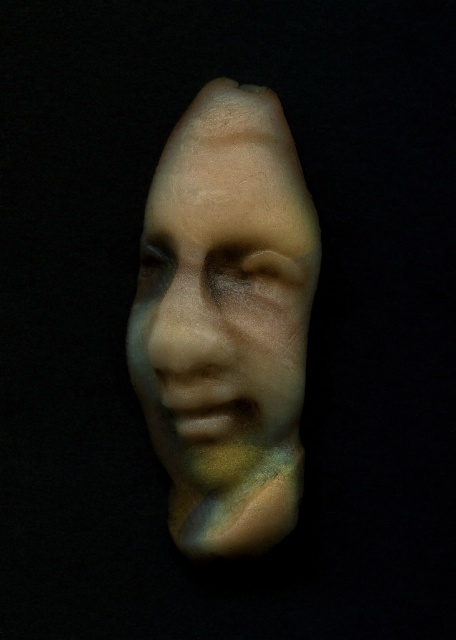
Question: From the image, what is the correct spatial relationship of iridescent plastic face at center in relation to matte beige nose at center?

Choices:
 (A) left
 (B) right

Answer: (B)

Question: Can you confirm if iridescent plastic face at center is positioned to the right of matte beige nose at center?

Choices:
 (A) no
 (B) yes

Answer: (B)

Question: Does iridescent plastic face at center have a smaller size compared to matte beige nose at center?

Choices:
 (A) no
 (B) yes

Answer: (A)

Question: Which point is farther to the camera?

Choices:
 (A) (185, 364)
 (B) (285, 182)

Answer: (B)

Question: Among these points, which one is nearest to the camera?

Choices:
 (A) (221, 337)
 (B) (191, 401)

Answer: (A)